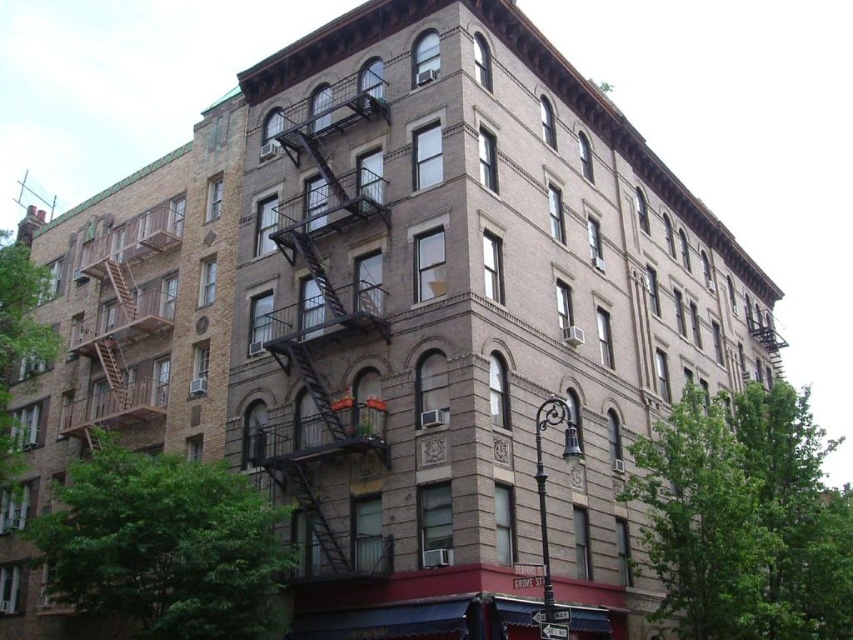
Can you confirm if black metal fire escape at center is thinner than brown wooden fire escape at left?

Indeed, black metal fire escape at center has a lesser width compared to brown wooden fire escape at left.

Does black metal fire escape at center appear over brown wooden fire escape at left?

Indeed, black metal fire escape at center is positioned over brown wooden fire escape at left.

Find the location of a particular element. This screenshot has height=640, width=853. black metal fire escape at center is located at coordinates click(326, 307).

Image resolution: width=853 pixels, height=640 pixels. What are the coordinates of `black metal fire escape at center` in the screenshot? It's located at (326, 307).